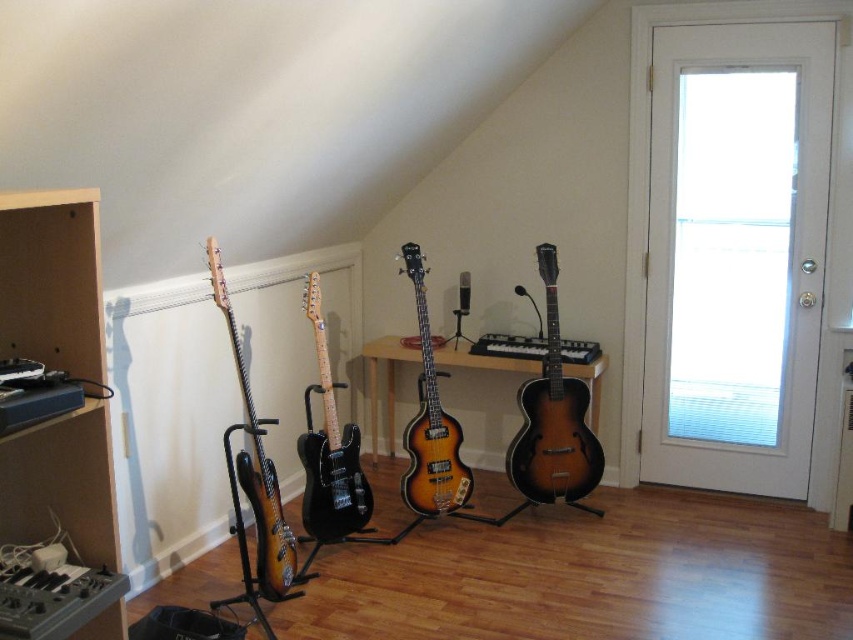
Based on the photo, you are standing in the room and want to move towards the sunburst wood acoustic guitar at center. Based on its position coordinates, which direction should you move relative to your current position?

The sunburst wood acoustic guitar at center is located at coordinates point [553,419]. Since coordinates typically range from 0 to 1, this position is closer to the right and bottom edges of the frame. Therefore, you should move towards the right and downward direction to reach it.

You are standing in the room and want to reach the black matte electric guitar at center. Given that you can stretch your arm 1.8 meters, can you comfortably reach it without moving your feet?

The black matte electric guitar at center is 2.95 meters away from you. Since your arm can only stretch 1.8 meters, you cannot comfortably reach it without moving your feet.

You are a musician who wants to retrieve the sunburst wood electric guitar at left from its current position. Since the sunburst wood bass guitar at center is blocking access to it, can you move the bass guitar to the right to make space? Please explain your reasoning based on their positions.

The sunburst wood bass guitar at center is positioned over the sunburst wood electric guitar at left, meaning the bass guitar is directly covering the electric guitar. Moving the bass guitar to the right would allow access to the electric guitar underneath.